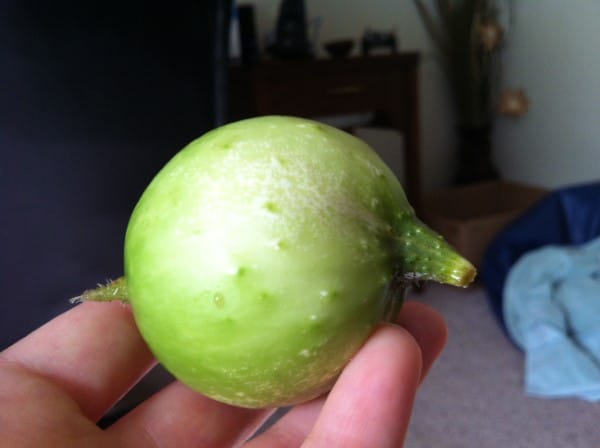
The width and height of the screenshot is (600, 448). In order to click on items on desk in this screenshot , I will do `click(377, 34)`, `click(344, 47)`, `click(295, 33)`.